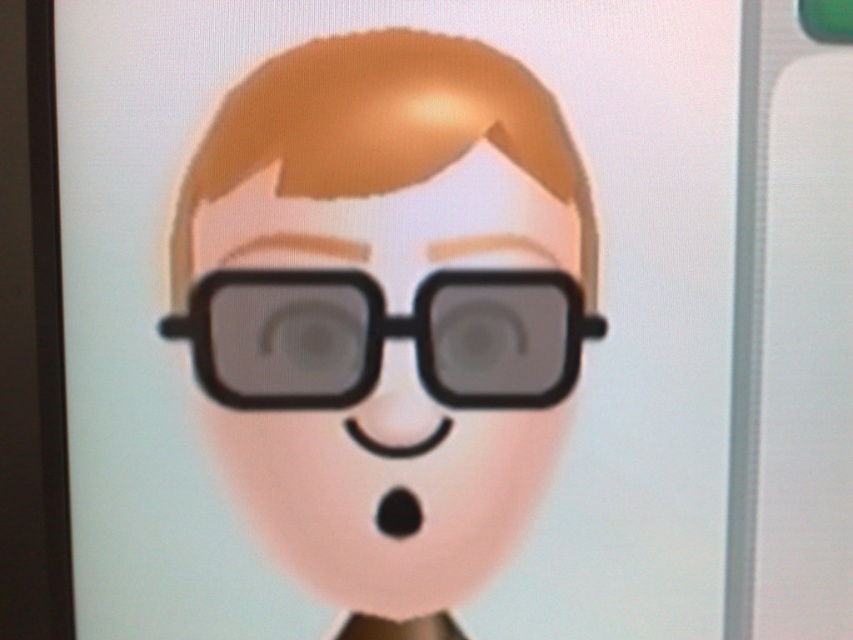
Question: Can you confirm if matte black glasses at center is positioned below black matte glasses at center?

Choices:
 (A) yes
 (B) no

Answer: (A)

Question: In this image, where is matte black glasses at center located relative to black matte glasses at center?

Choices:
 (A) below
 (B) above

Answer: (A)

Question: Can you confirm if matte black glasses at center is bigger than black matte glasses at center?

Choices:
 (A) yes
 (B) no

Answer: (A)

Question: Among these objects, which one is nearest to the camera?

Choices:
 (A) matte black glasses at center
 (B) black matte glasses at center

Answer: (A)

Question: Which of the following is the farthest from the observer?

Choices:
 (A) (280, 550)
 (B) (343, 365)

Answer: (A)